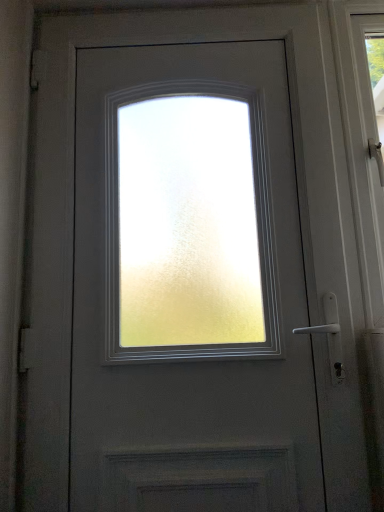
Describe the element at coordinates (189, 286) in the screenshot. I see `matte gray door at center` at that location.

This screenshot has width=384, height=512. Find the location of `matte gray door at center`. matte gray door at center is located at coordinates (189, 286).

Identify the location of matte gray door at center. (189, 286).